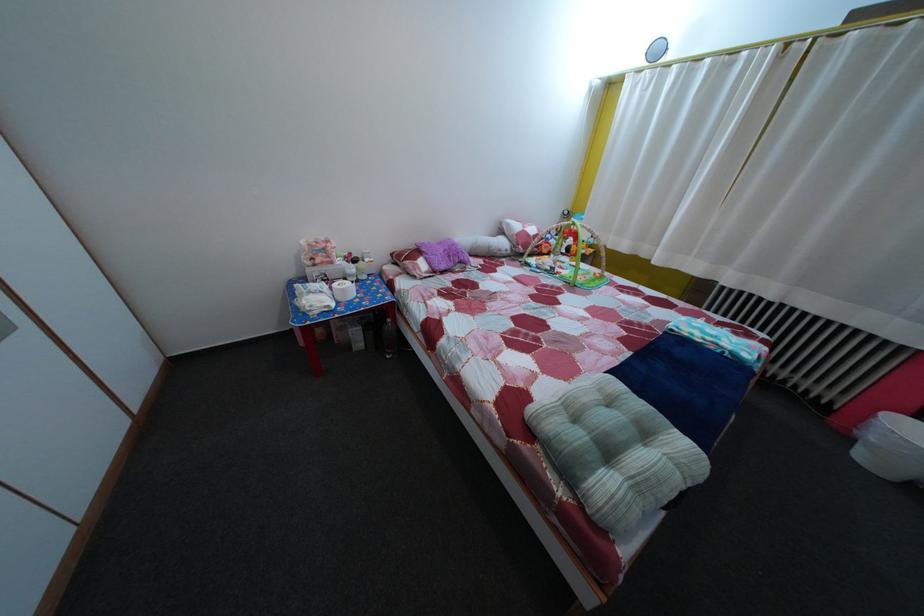
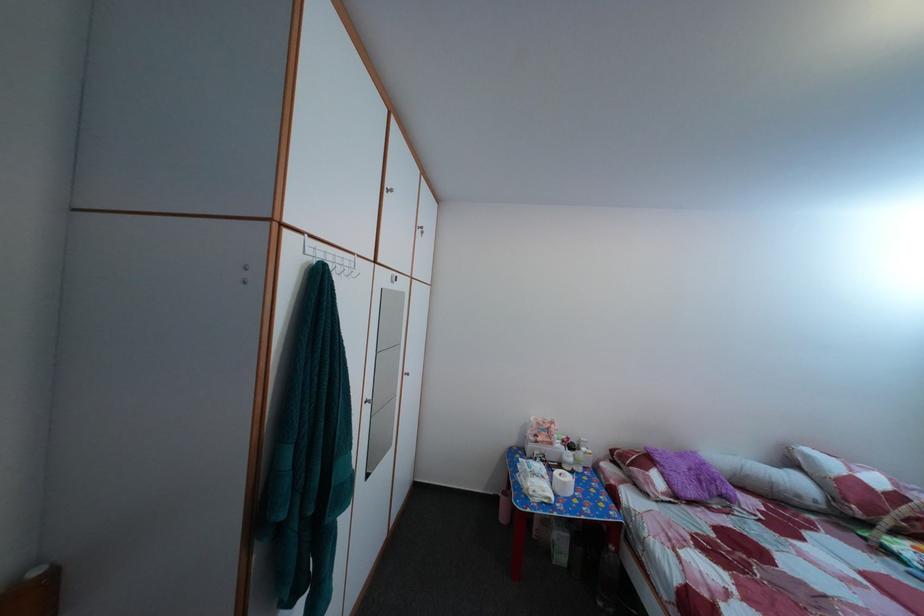
In the second image, find the point that corresponds to (517,233) in the first image.

(817, 464)